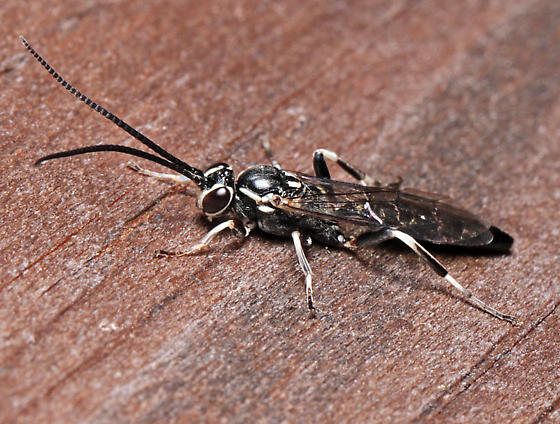
Locate an element on the screen. This screenshot has width=560, height=424. wooden surface is located at coordinates (196, 339).